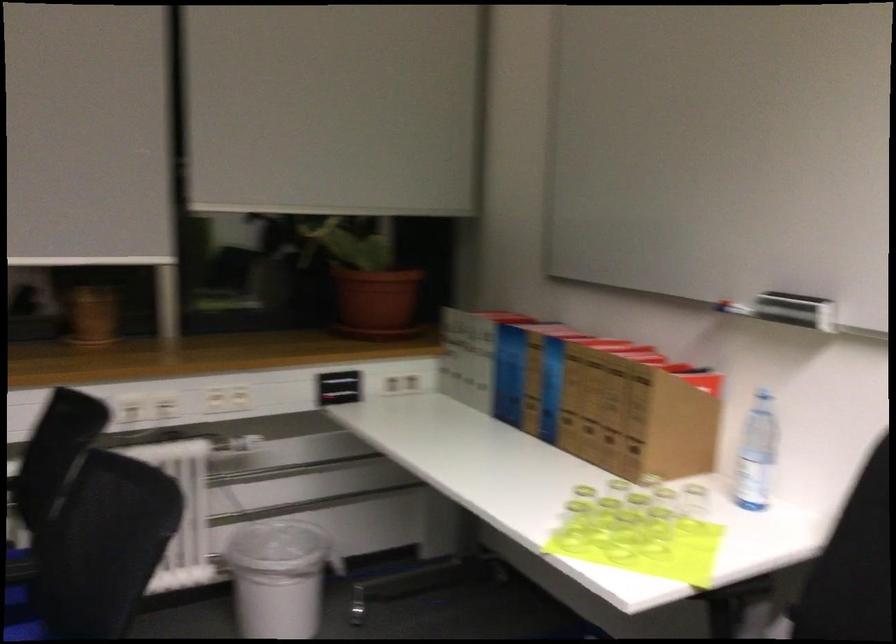
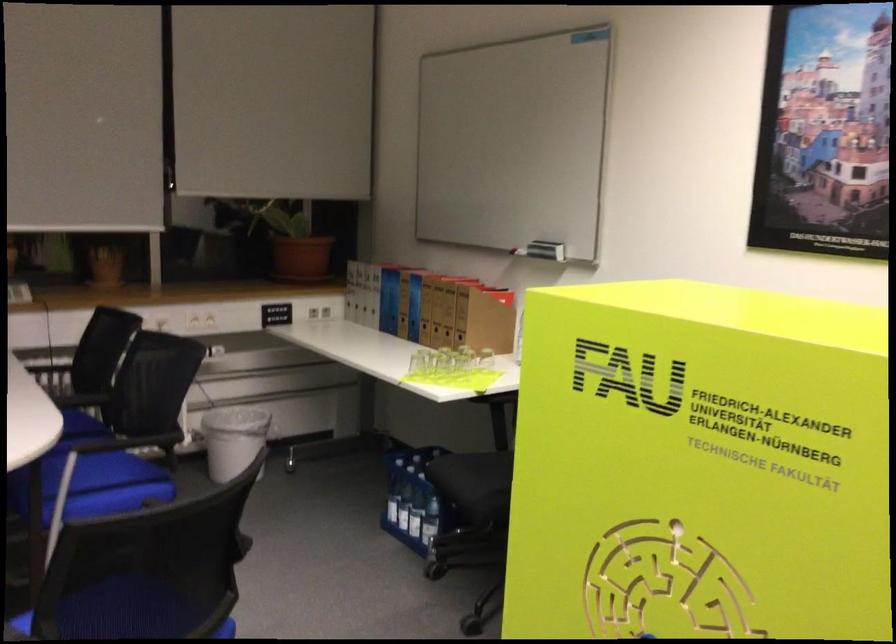
The point at (x=364, y=281) is marked in the first image. Where is the corresponding point in the second image?

(294, 243)